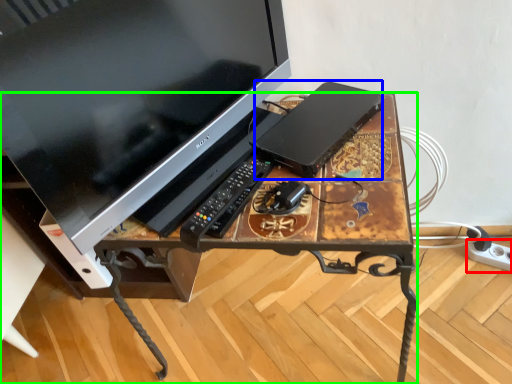
Question: Which object is positioned farthest from extension cord (highlighted by a red box)? Select from computer (highlighted by a blue box) and desk (highlighted by a green box).

Choices:
 (A) computer
 (B) desk

Answer: (B)